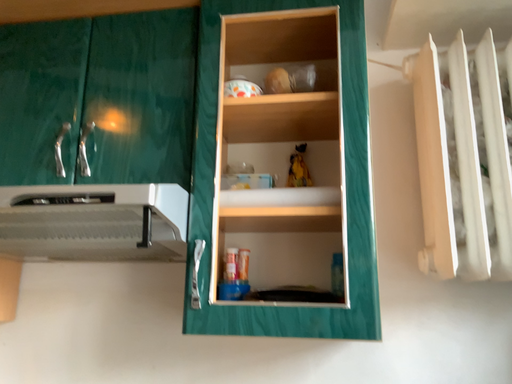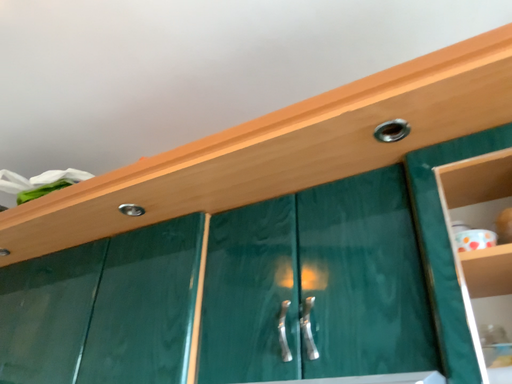
Question: Which way did the camera rotate in the video?

Choices:
 (A) rotated right
 (B) rotated left

Answer: (B)